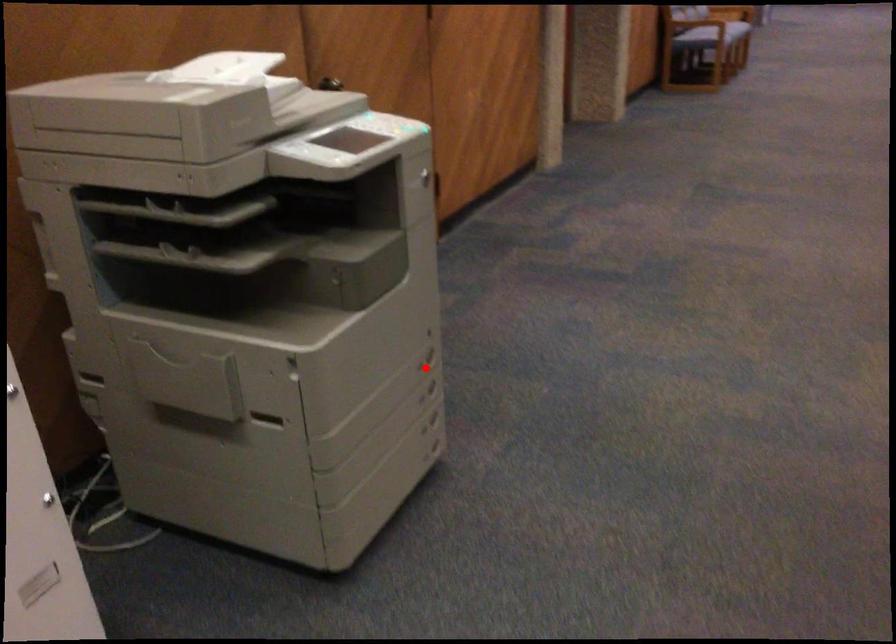
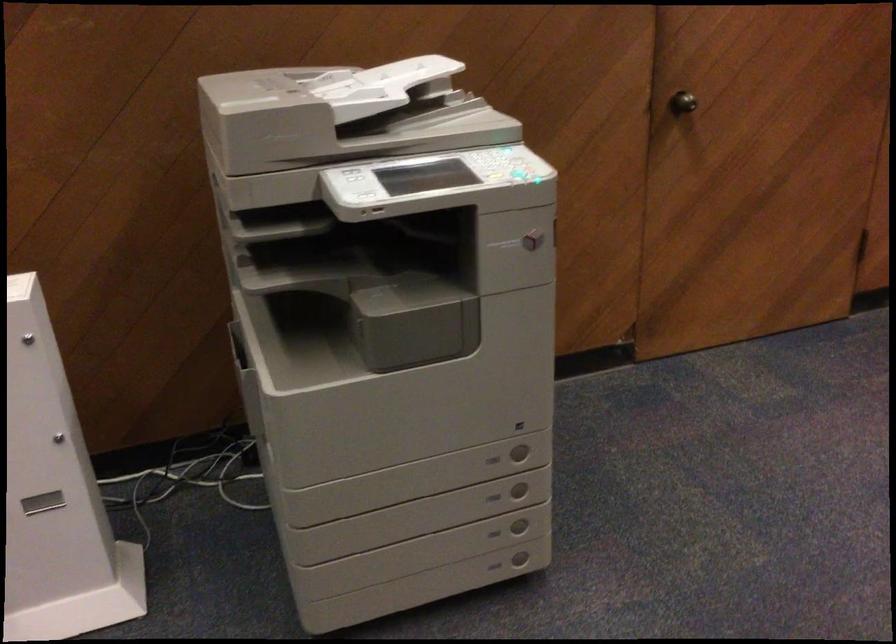
Where in the second image is the point corresponding to the highlighted location from the first image?

(492, 459)